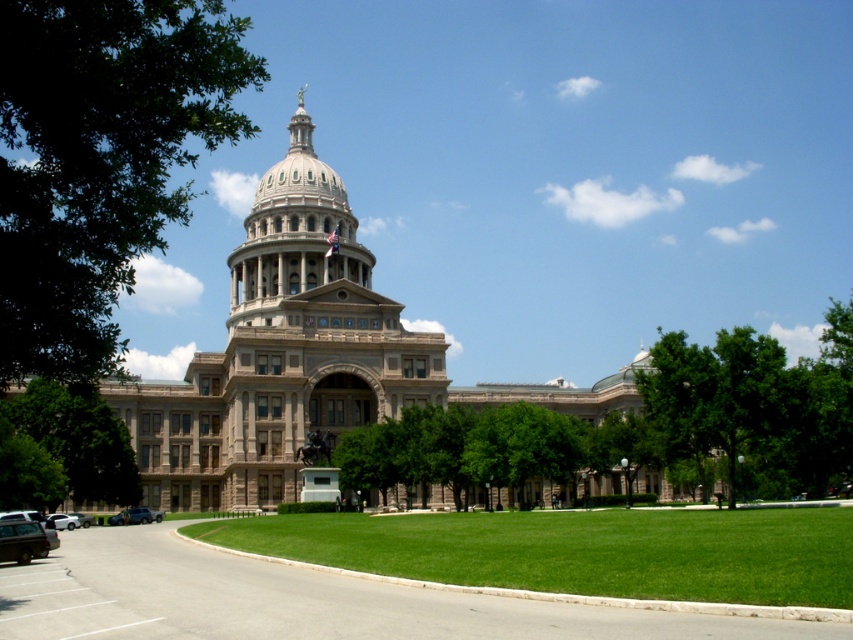
Does green leafy tree at upper left have a lesser height compared to silver metallic sedan at lower left?

Incorrect, green leafy tree at upper left's height does not fall short of silver metallic sedan at lower left's.

Is green leafy tree at upper left smaller than silver metallic sedan at lower left?

Incorrect, green leafy tree at upper left is not smaller in size than silver metallic sedan at lower left.

The height and width of the screenshot is (640, 853). What are the coordinates of `green leafy tree at upper left` in the screenshot? It's located at (100, 161).

How much distance is there between matte black truck at lower left and silver metallic sedan at lower left?

The distance of matte black truck at lower left from silver metallic sedan at lower left is 5.97 meters.

Does matte black truck at lower left have a lesser width compared to silver metallic sedan at lower left?

Yes, matte black truck at lower left is thinner than silver metallic sedan at lower left.

Which is in front, point (131, 522) or point (88, 516)?

Point (88, 516) is in front.

I want to click on matte black truck at lower left, so click(x=135, y=516).

Is matte black truck at lower left below white matte car at lower left?

Indeed, matte black truck at lower left is positioned under white matte car at lower left.

Is matte black truck at lower left thinner than white matte car at lower left?

Yes, matte black truck at lower left is thinner than white matte car at lower left.

Locate an element on the screen. Image resolution: width=853 pixels, height=640 pixels. matte black truck at lower left is located at coordinates (135, 516).